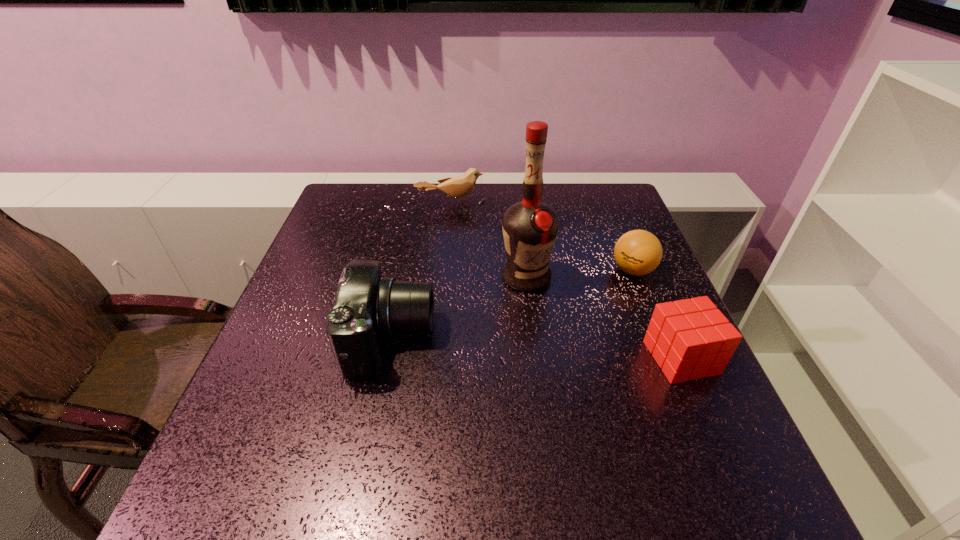
The image size is (960, 540). What are the coordinates of `vacant area located on the side with brand of the ping-pong ball` in the screenshot? It's located at (594, 291).

Identify the location of vacant space located 0.250m at the beak of the bird. The width and height of the screenshot is (960, 540). (481, 265).

Locate an element on the screen. vacant space located 0.290m at the beak of the bird is located at coordinates (485, 274).

Identify the location of vacant space located 0.120m at the beak of the bird. Image resolution: width=960 pixels, height=540 pixels. (469, 236).

At what (x,y) coordinates should I click in order to perform the action: click on free location located on the front and back of the tallest object. Please return your answer as a coordinate pair (x, y). Looking at the image, I should click on (562, 452).

Find the location of a particular element. This screenshot has width=960, height=540. vacant region located on the front and back of the tallest object is located at coordinates (540, 343).

The height and width of the screenshot is (540, 960). I want to click on vacant region located on the front and back of the tallest object, so click(544, 366).

Where is `object positioned at the far edge`? object positioned at the far edge is located at coordinates (458, 187).

Find the location of a particular element. This screenshot has height=540, width=960. cube situated at the right edge is located at coordinates (690, 339).

Locate an element on the screen. The image size is (960, 540). ping-pong ball that is at the right edge is located at coordinates (638, 252).